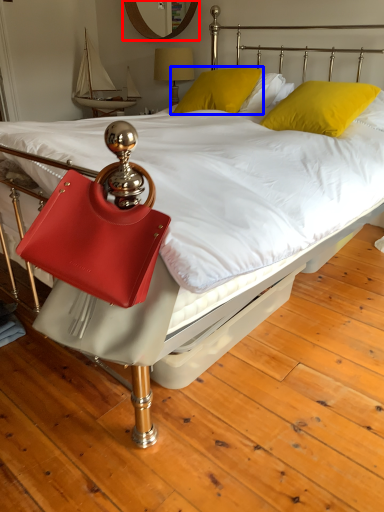
Question: Which point is closer to the camera, mirror (highlighted by a red box) or pillow (highlighted by a blue box)?

Choices:
 (A) mirror
 (B) pillow

Answer: (B)